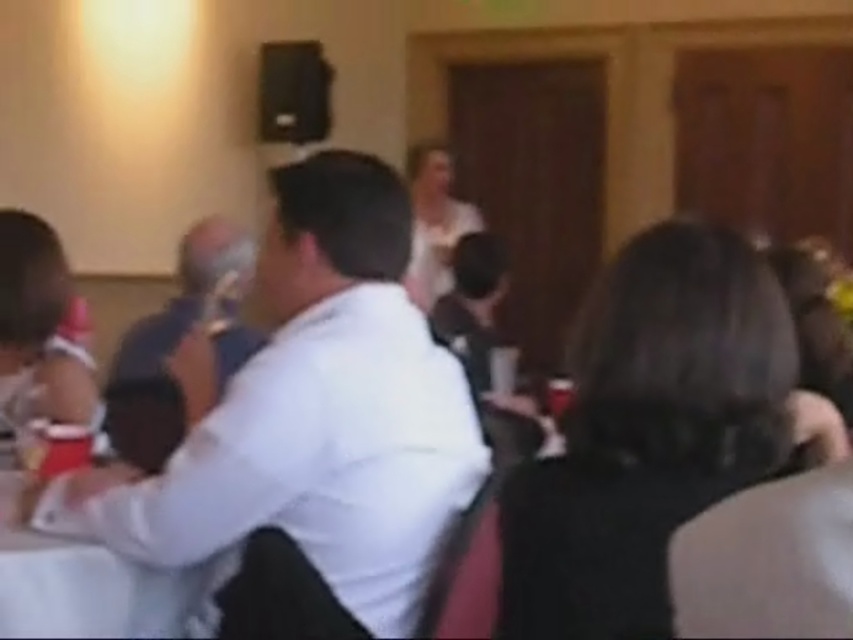
Find the location of a particular element. white fabric table at center is located at coordinates (82, 582).

Is point (80, 596) in front of point (425, 294)?

Yes, it is.

Is point (183, 632) in front of point (442, 170)?

Yes, it is.

What are the coordinates of `white fabric table at center` in the screenshot? It's located at (82, 582).

Does black fabric hair at center appear on the left side of white fabric table at center?

In fact, black fabric hair at center is to the right of white fabric table at center.

Locate an element on the screen. This screenshot has height=640, width=853. black fabric hair at center is located at coordinates (648, 433).

Is point (720, 380) behind point (431, 234)?

No, it is in front of (431, 234).

Is black fabric hair at center smaller than white matte dress at center?

Indeed, black fabric hair at center has a smaller size compared to white matte dress at center.

What do you see at coordinates (648, 433) in the screenshot?
I see `black fabric hair at center` at bounding box center [648, 433].

I want to click on black fabric hair at center, so pyautogui.click(x=648, y=433).